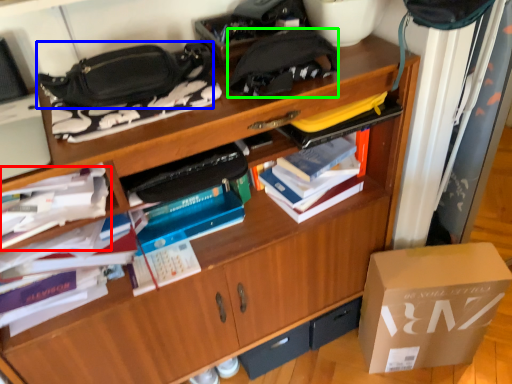
Question: Estimate the real-world distances between objects in this image. Which object is farther from book (highlighted by a red box), handbag (highlighted by a blue box) or pouch (highlighted by a green box)?

Choices:
 (A) handbag
 (B) pouch

Answer: (B)